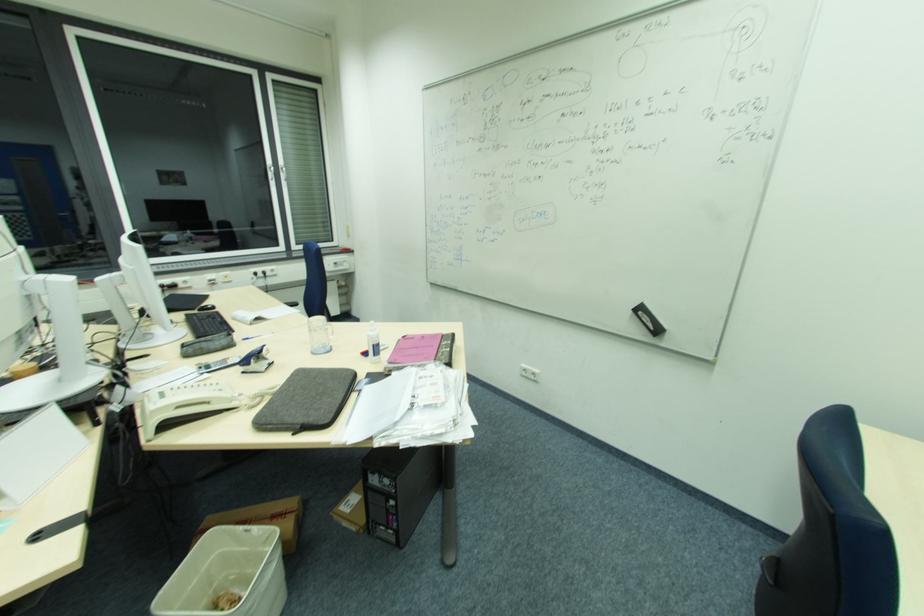
The location [227,573] corresponds to which object?

This point indicates the white plastic wastebasket.